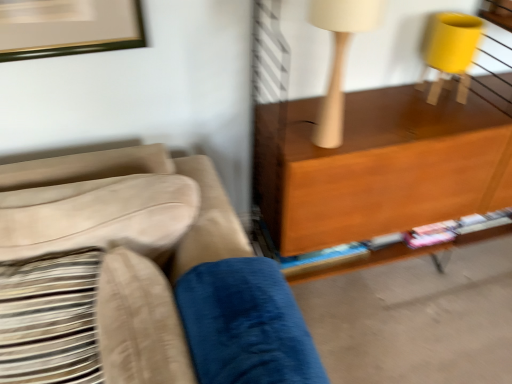
Question: Does velvety blue pillow at lower center, the 2th pillow positioned from the left, turn towards white matte table lamp at upper right?

Choices:
 (A) no
 (B) yes

Answer: (A)

Question: Is velvety blue pillow at lower center, the 2th pillow positioned from the left, far away from white matte table lamp at upper right?

Choices:
 (A) yes
 (B) no

Answer: (B)

Question: Is velvety blue pillow at lower center, the first pillow positioned from the right, with white matte table lamp at upper right?

Choices:
 (A) yes
 (B) no

Answer: (B)

Question: Is velvety blue pillow at lower center, the 2th pillow positioned from the left, shorter than white matte table lamp at upper right?

Choices:
 (A) yes
 (B) no

Answer: (B)

Question: Does velvety blue pillow at lower center, the 2th pillow positioned from the left, come behind white matte table lamp at upper right?

Choices:
 (A) no
 (B) yes

Answer: (A)

Question: Considering the relative sizes of velvety blue pillow at lower center, the first pillow positioned from the right, and white matte table lamp at upper right in the image provided, is velvety blue pillow at lower center, the first pillow positioned from the right, thinner than white matte table lamp at upper right?

Choices:
 (A) no
 (B) yes

Answer: (A)

Question: Is velvety blue pillow at lower center, the 2th pillow positioned from the left, further to the viewer compared to suede beige couch at left?

Choices:
 (A) no
 (B) yes

Answer: (B)

Question: Is velvety blue pillow at lower center, the 2th pillow positioned from the left, looking in the opposite direction of suede beige couch at left?

Choices:
 (A) no
 (B) yes

Answer: (B)

Question: Can you confirm if velvety blue pillow at lower center, the 2th pillow positioned from the left, is smaller than suede beige couch at left?

Choices:
 (A) yes
 (B) no

Answer: (A)

Question: Can you confirm if velvety blue pillow at lower center, the 2th pillow positioned from the left, is bigger than suede beige couch at left?

Choices:
 (A) yes
 (B) no

Answer: (B)

Question: Is velvety blue pillow at lower center, the first pillow positioned from the right, at the right side of suede beige couch at left?

Choices:
 (A) yes
 (B) no

Answer: (A)

Question: Is velvety blue pillow at lower center, the 2th pillow positioned from the left, not inside suede beige couch at left?

Choices:
 (A) yes
 (B) no

Answer: (B)

Question: Is white matte table lamp at upper right positioned in front of velvety blue pillow at lower center, the 2th pillow positioned from the left?

Choices:
 (A) yes
 (B) no

Answer: (B)